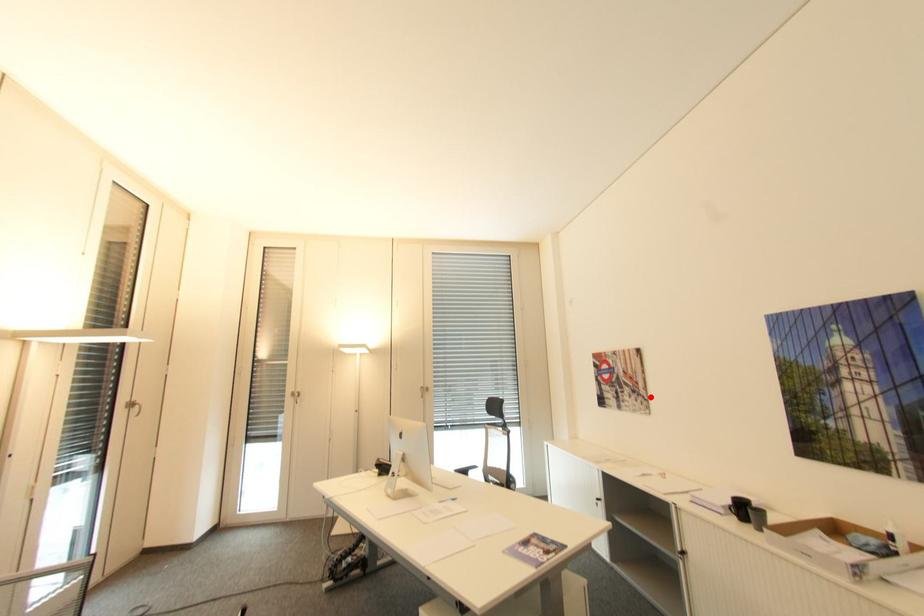
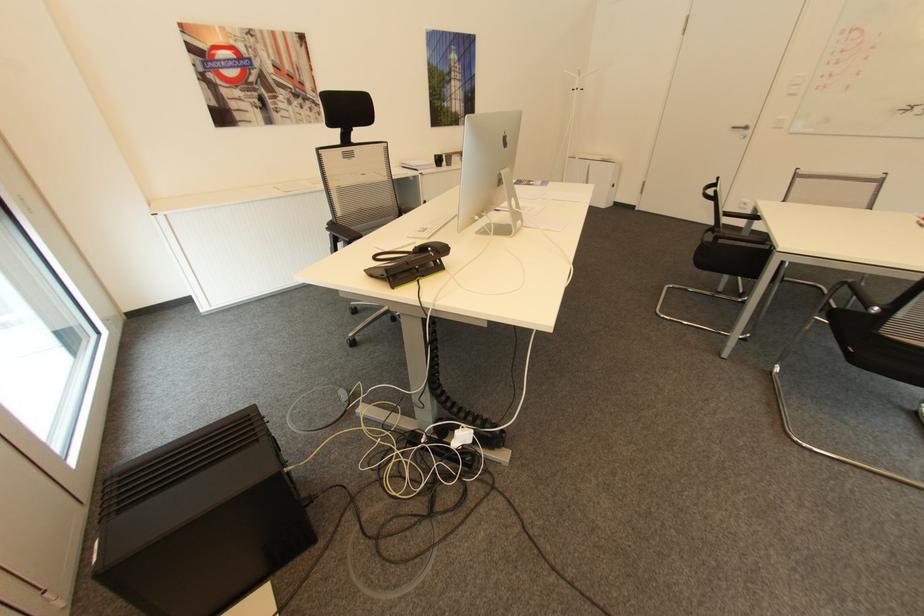
Question: I am providing you with two images of the same scene from different viewpoints. A red point is marked on the first image. At the location where the point appears in image 1, is it still visible in image 2?

Choices:
 (A) Yes
 (B) No

Answer: (A)